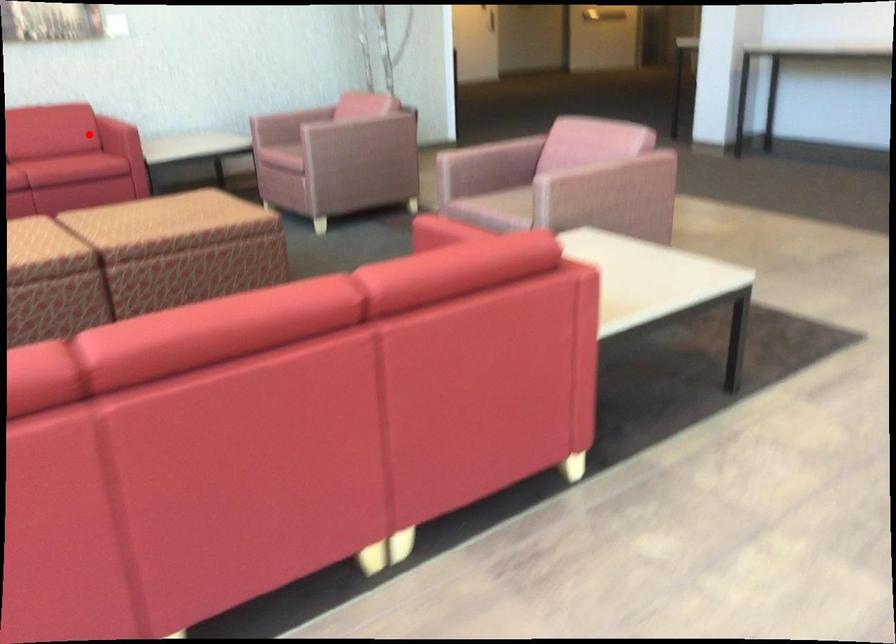
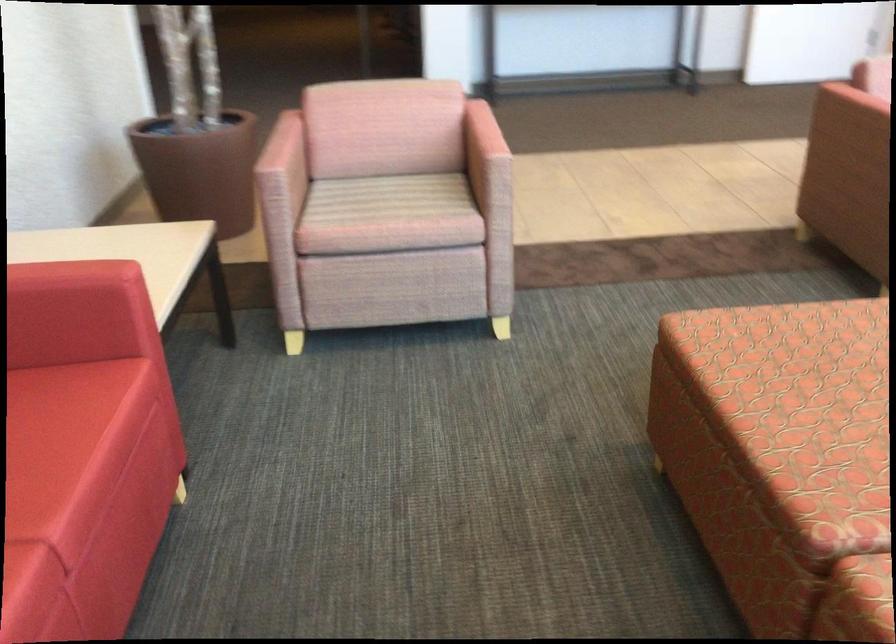
Find the pixel in the second image that matches the highlighted location in the first image.

(38, 408)